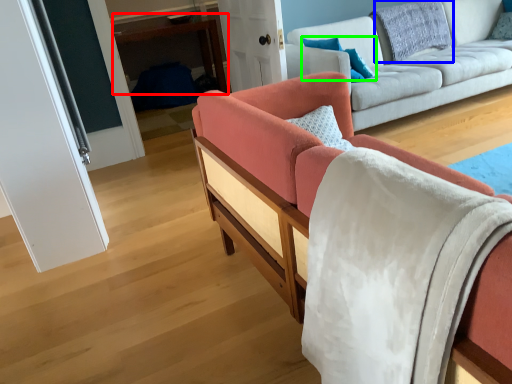
Question: Which object is the farthest from table (highlighted by a red box)? Choose among these: pillow (highlighted by a blue box) or pillow (highlighted by a green box).

Choices:
 (A) pillow
 (B) pillow

Answer: (B)